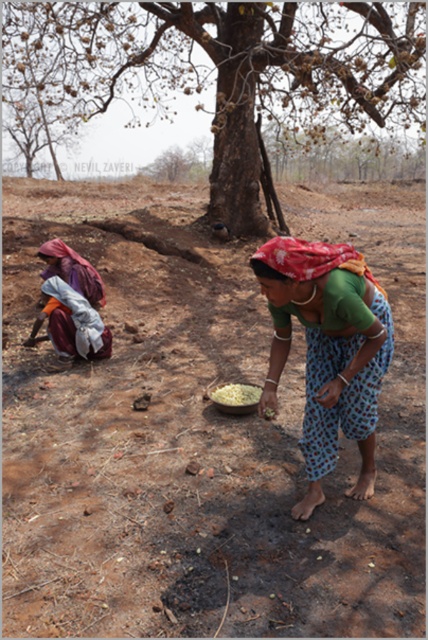
You are a farmer standing in the middle of the field and you see the brown rough tree at center and the green fabric cloth at center. Which object is higher from the ground?

The brown rough tree at center is located above the green fabric cloth at center, so the brown rough tree at center is higher from the ground.

You are a farmer who wants to plant seeds in the brown soil at center. You have a seed bag that needs to be placed near the brown rough tree at center. Based on the scene, where should you place the seed bag relative to the tree?

The brown soil at center is positioned on the right side of brown rough tree at center, so you should place the seed bag to the left side of the brown rough tree at center to keep it near the tree.